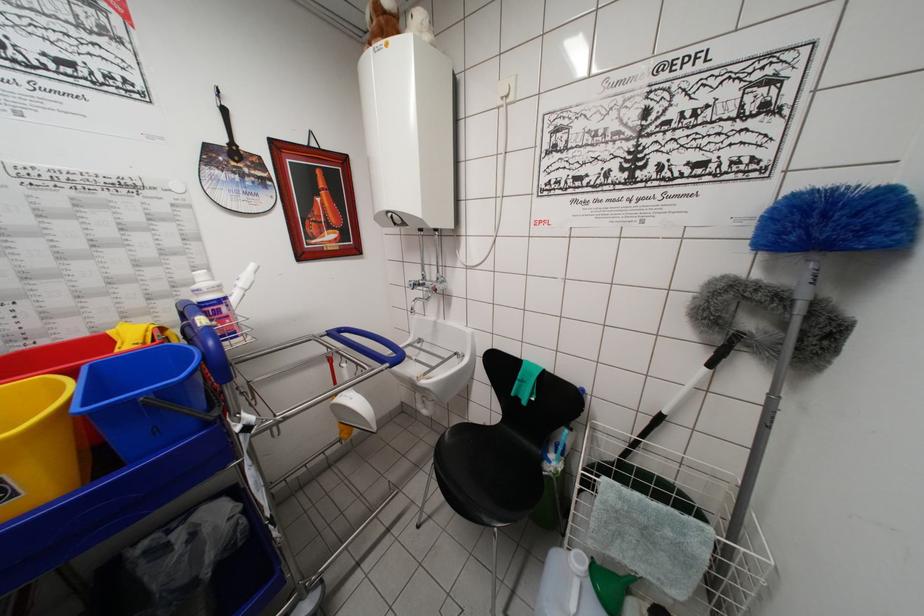
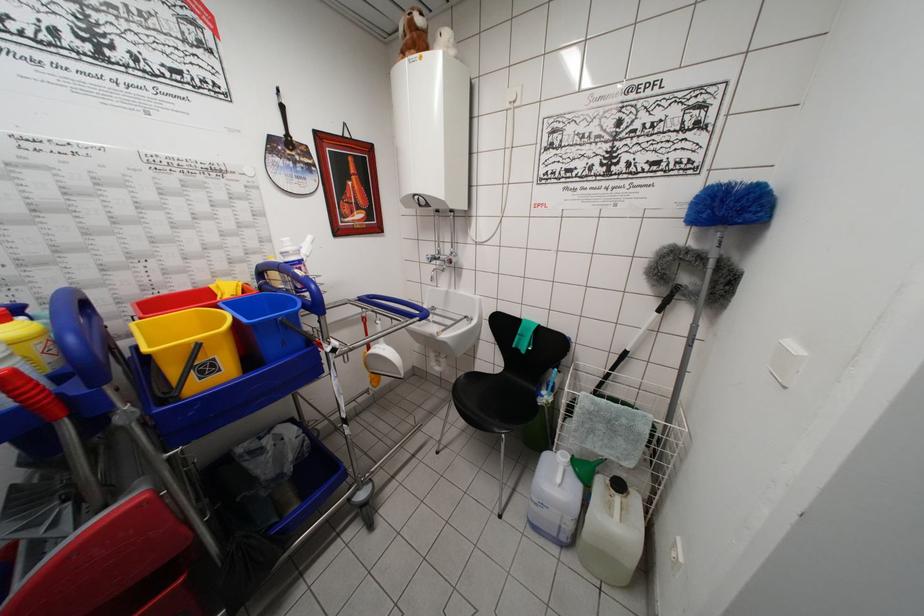
In the second image, find the point that corresponds to the point at 601,565 in the first image.

(579, 462)